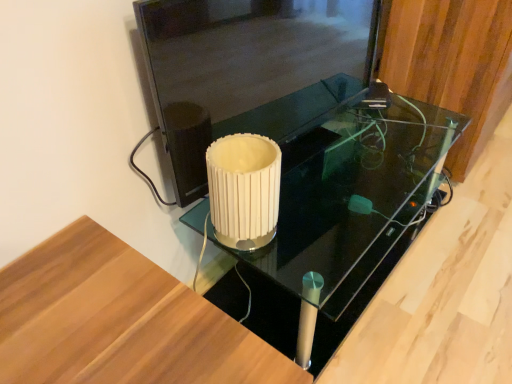
Question: Is the depth of wooden panel at upper right greater than that of black glass table at center?

Choices:
 (A) no
 (B) yes

Answer: (B)

Question: Does wooden panel at upper right have a lesser height compared to black glass table at center?

Choices:
 (A) no
 (B) yes

Answer: (A)

Question: Can black glass table at center be found inside wooden panel at upper right?

Choices:
 (A) yes
 (B) no

Answer: (B)

Question: Considering the relative sizes of wooden panel at upper right and black glass table at center in the image provided, is wooden panel at upper right wider than black glass table at center?

Choices:
 (A) no
 (B) yes

Answer: (A)

Question: From a real-world perspective, does wooden panel at upper right sit lower than black glass table at center?

Choices:
 (A) yes
 (B) no

Answer: (B)

Question: Is wooden panel at upper right at the left side of black glass table at center?

Choices:
 (A) no
 (B) yes

Answer: (A)

Question: From the image's perspective, is white ribbed glass at center above transparent glass door at center?

Choices:
 (A) yes
 (B) no

Answer: (B)

Question: Is white ribbed glass at center behind transparent glass door at center?

Choices:
 (A) no
 (B) yes

Answer: (B)

Question: From a real-world perspective, is white ribbed glass at center below transparent glass door at center?

Choices:
 (A) no
 (B) yes

Answer: (B)

Question: Is white ribbed glass at center positioned with its back to transparent glass door at center?

Choices:
 (A) yes
 (B) no

Answer: (A)

Question: Considering the relative positions of white ribbed glass at center and transparent glass door at center in the image provided, is white ribbed glass at center to the right of transparent glass door at center from the viewer's perspective?

Choices:
 (A) yes
 (B) no

Answer: (B)

Question: Does white ribbed glass at center have a larger size compared to transparent glass door at center?

Choices:
 (A) yes
 (B) no

Answer: (B)

Question: Considering the relative sizes of transparent glass door at center and white ribbed glass at center in the image provided, is transparent glass door at center wider than white ribbed glass at center?

Choices:
 (A) yes
 (B) no

Answer: (B)